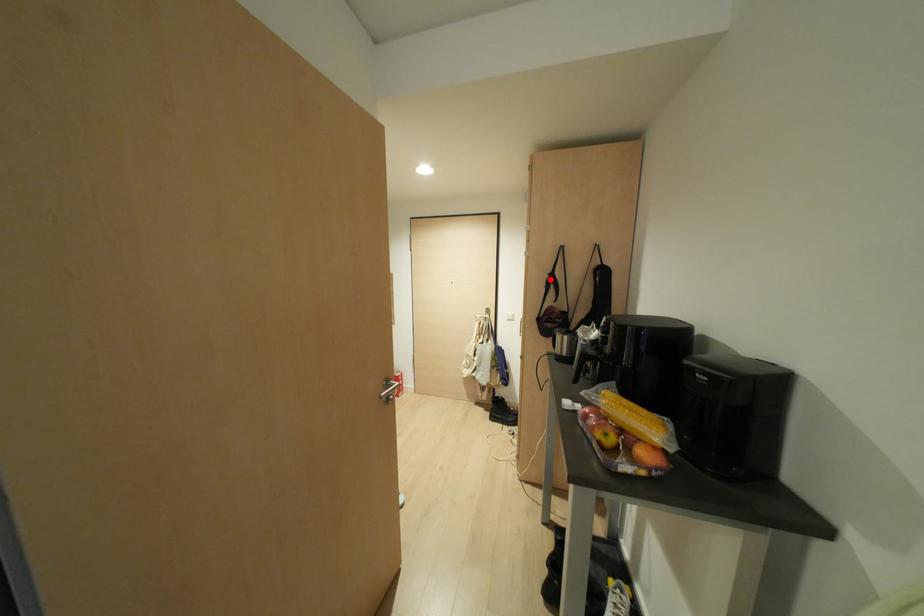
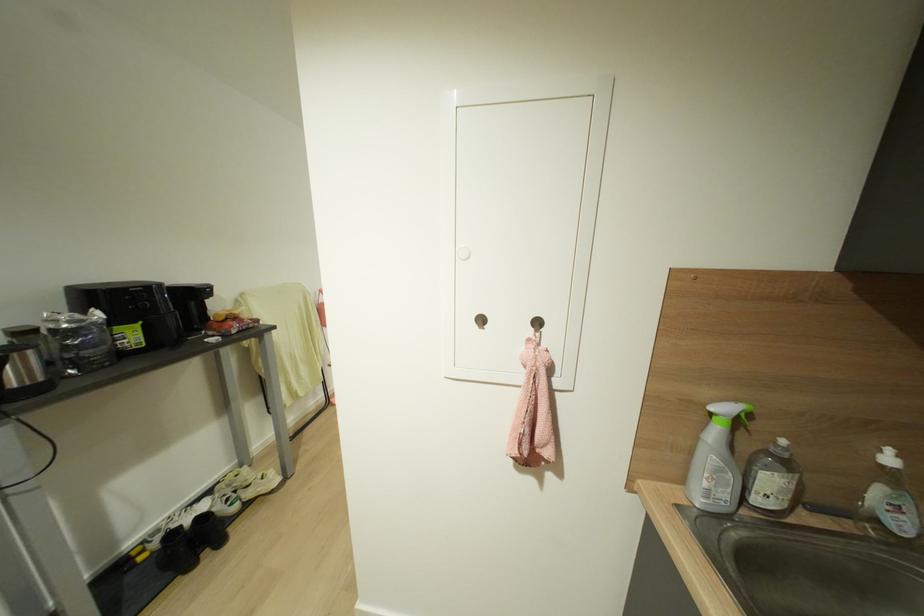
Question: I am providing you with two images of the same scene from different viewpoints. A red point is marked on the first image. At the location where the point appears in image 1, is it still visible in image 2?

Choices:
 (A) Yes
 (B) No

Answer: (B)